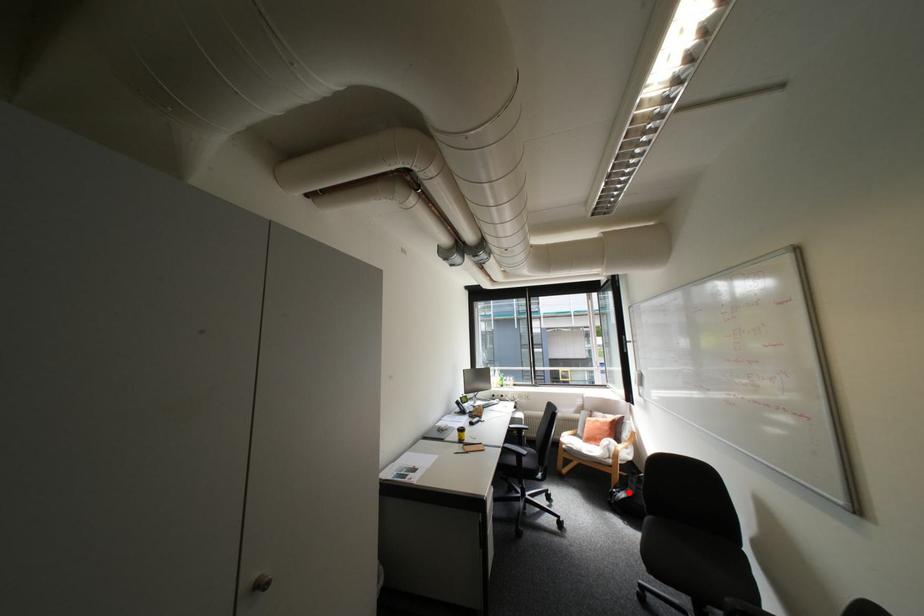
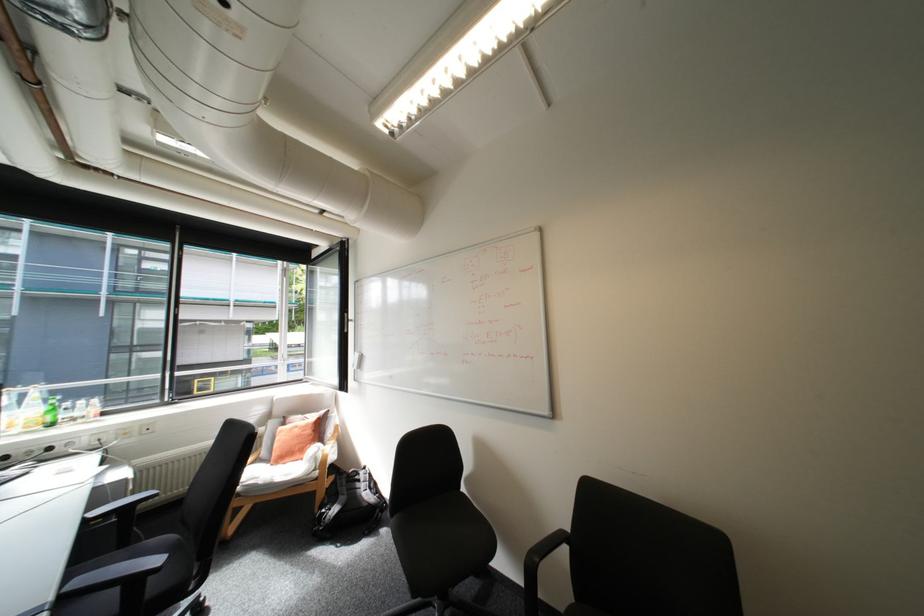
Where in the second image is the point corresponding to the highlighted location from the first image?

(339, 509)